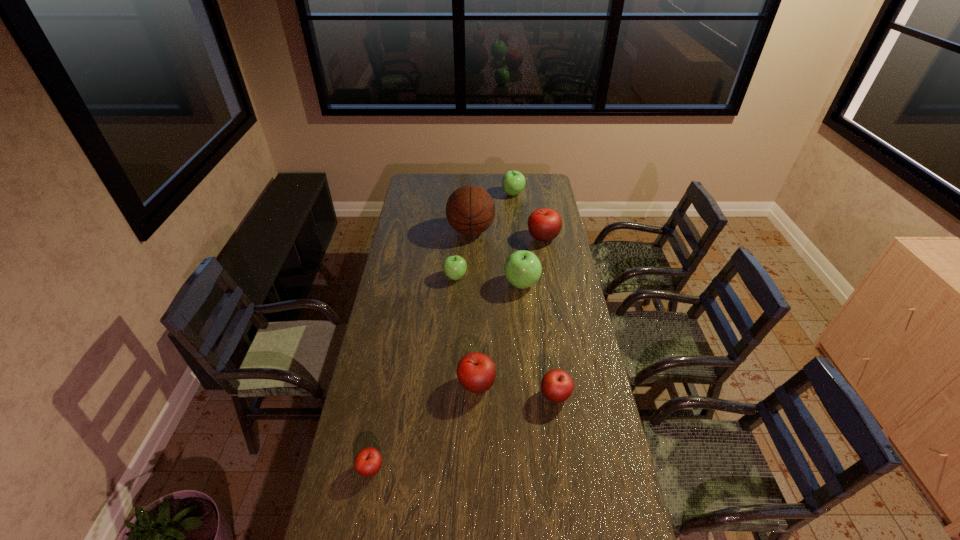
Identify the location of the tallest object. (470, 210).

You are a GUI agent. You are given a task and a screenshot of the screen. Output one action in this format:
    pyautogui.click(x=<x>, y=<y>)
    Task: Click on the basketball
    The height and width of the screenshot is (540, 960).
    Given the screenshot: What is the action you would take?
    (x=470, y=210)

Locate an element on the screen. the biggest green apple is located at coordinates (522, 269).

Locate an element on the screen. This screenshot has width=960, height=540. the farthest red apple is located at coordinates (544, 224).

The width and height of the screenshot is (960, 540). In order to click on the biggest red apple in this screenshot , I will do `click(544, 224)`.

I want to click on the farthest green apple, so click(x=513, y=182).

Where is `the second biggest green apple`? Image resolution: width=960 pixels, height=540 pixels. the second biggest green apple is located at coordinates (513, 182).

Locate an element on the screen. Image resolution: width=960 pixels, height=540 pixels. the second red apple from left to right is located at coordinates (476, 372).

Where is `the smallest green apple`? Image resolution: width=960 pixels, height=540 pixels. the smallest green apple is located at coordinates (454, 267).

The width and height of the screenshot is (960, 540). I want to click on the second smallest red apple, so click(x=557, y=385).